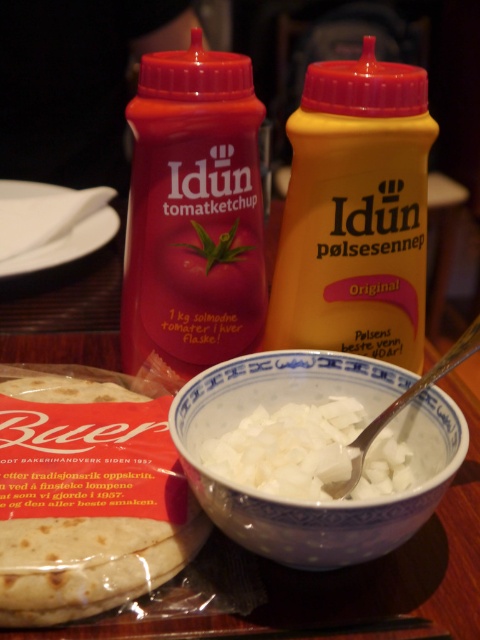
Between white creamy bowl at center and white diced onion at center, which one is positioned higher?

white creamy bowl at center is above.

Is white creamy bowl at center bigger than white diced onion at center?

Yes, white creamy bowl at center is bigger than white diced onion at center.

Describe the element at coordinates (356, 212) in the screenshot. The image size is (480, 640). I see `white creamy bowl at center` at that location.

In order to click on white creamy bowl at center in this screenshot , I will do `click(356, 212)`.

Which is in front, point (273, 298) or point (361, 378)?

Point (361, 378) is in front.

Can you confirm if white creamy bowl at center is wider than white porcelain bowl at center?

No.

Identify the location of white creamy bowl at center. This screenshot has width=480, height=640. (356, 212).

Which is behind, point (83, 572) or point (321, 410)?

Point (321, 410)

Is golden brown flatbread at lower left smaller than white diced onion at center?

No, golden brown flatbread at lower left is not smaller than white diced onion at center.

The height and width of the screenshot is (640, 480). Find the location of `golden brown flatbread at lower left`. golden brown flatbread at lower left is located at coordinates (87, 563).

I want to click on golden brown flatbread at lower left, so click(x=87, y=563).